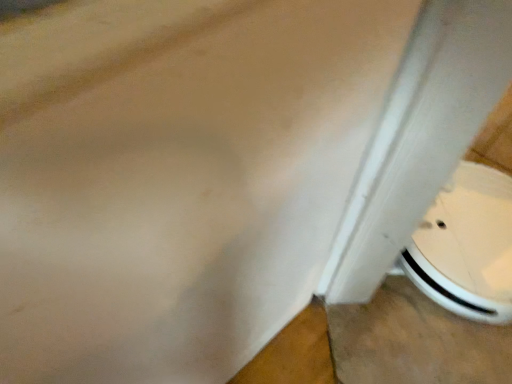
At what (x,y) coordinates should I click in order to perform the action: click on white glossy toilet at lower right. Please return your answer as a coordinate pair (x, y). This screenshot has width=512, height=384. Looking at the image, I should click on (467, 246).

What do you see at coordinates (467, 246) in the screenshot?
I see `white glossy toilet at lower right` at bounding box center [467, 246].

I want to click on white glossy toilet at lower right, so click(x=467, y=246).